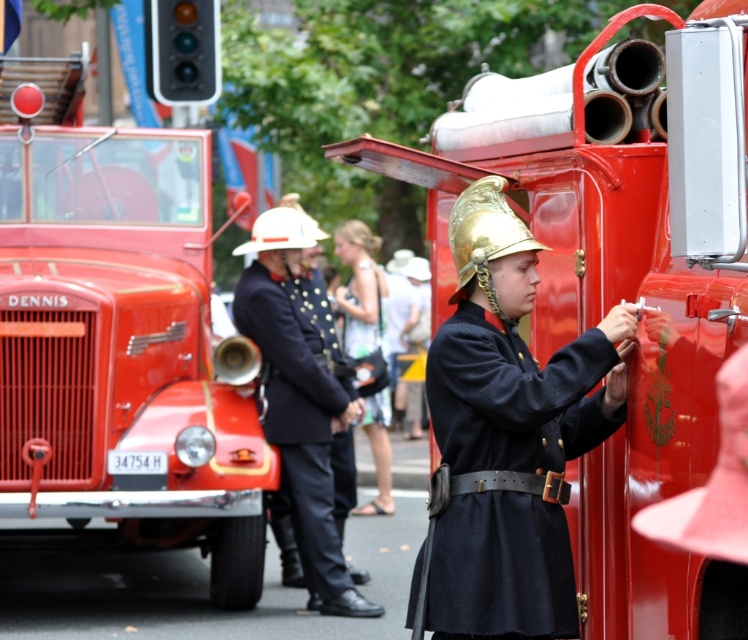
Question: Which object is farther from the camera taking this photo?

Choices:
 (A) shiny red fire truck at left
 (B) shiny red fire truck at center
 (C) navy blue fabric uniform at center

Answer: (C)

Question: Can you confirm if shiny red fire truck at left is positioned above shiny red fire truck at center?

Choices:
 (A) no
 (B) yes

Answer: (A)

Question: Which object appears farthest from the camera in this image?

Choices:
 (A) shiny red fire truck at left
 (B) navy blue fabric uniform at center
 (C) navy blue fabric coat at center
 (D) shiny red fire truck at center

Answer: (B)

Question: Is the position of shiny red fire truck at left less distant than that of navy blue fabric coat at center?

Choices:
 (A) no
 (B) yes

Answer: (A)

Question: Is shiny red fire truck at left above navy blue fabric coat at center?

Choices:
 (A) no
 (B) yes

Answer: (B)

Question: Which of these objects is positioned closest to the navy blue fabric coat at center?

Choices:
 (A) shiny red fire truck at left
 (B) shiny red fire truck at center
 (C) navy blue fabric uniform at center

Answer: (B)